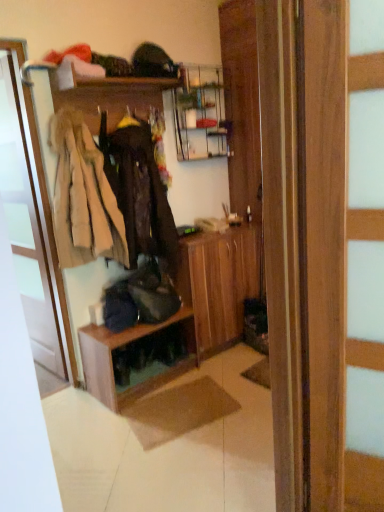
Question: Does dark brown leather jacket at center, the second clothing when ordered from left to right, appear on the left side of beige fur coat at left, the first clothing viewed from the left?

Choices:
 (A) no
 (B) yes

Answer: (A)

Question: Is dark brown leather jacket at center, which ranks as the 1th clothing in right-to-left order, placed right next to beige fur coat at left, the first clothing viewed from the left?

Choices:
 (A) no
 (B) yes

Answer: (A)

Question: Is dark brown leather jacket at center, which ranks as the 1th clothing in right-to-left order, positioned in front of beige fur coat at left, placed as the 2th clothing when sorted from right to left?

Choices:
 (A) no
 (B) yes

Answer: (A)

Question: From the image's perspective, is dark brown leather jacket at center, the second clothing when ordered from left to right, below beige fur coat at left, the first clothing viewed from the left?

Choices:
 (A) no
 (B) yes

Answer: (A)

Question: Does dark brown leather jacket at center, the second clothing when ordered from left to right, have a smaller size compared to beige fur coat at left, placed as the 2th clothing when sorted from right to left?

Choices:
 (A) yes
 (B) no

Answer: (B)

Question: Does dark brown leather jacket at center, which ranks as the 1th clothing in right-to-left order, turn towards beige fur coat at left, the first clothing viewed from the left?

Choices:
 (A) no
 (B) yes

Answer: (A)

Question: Considering the relative positions of wooden coat rack at upper left, the 1th shelf positioned from the top, and white glossy door at left in the image provided, is wooden coat rack at upper left, the 1th shelf positioned from the top, to the left of white glossy door at left from the viewer's perspective?

Choices:
 (A) yes
 (B) no

Answer: (B)

Question: Is wooden coat rack at upper left, acting as the 2th shelf starting from the bottom, not near white glossy door at left?

Choices:
 (A) no
 (B) yes

Answer: (A)

Question: Does wooden coat rack at upper left, acting as the 2th shelf starting from the bottom, appear on the right side of white glossy door at left?

Choices:
 (A) yes
 (B) no

Answer: (A)

Question: Is the position of wooden coat rack at upper left, the 1th shelf positioned from the top, less distant than that of white glossy door at left?

Choices:
 (A) yes
 (B) no

Answer: (B)

Question: Would you say white glossy door at left is part of wooden coat rack at upper left, the 1th shelf positioned from the top,'s contents?

Choices:
 (A) no
 (B) yes

Answer: (A)

Question: Considering the relative sizes of wooden coat rack at upper left, the 1th shelf positioned from the top, and white glossy door at left in the image provided, is wooden coat rack at upper left, the 1th shelf positioned from the top, wider than white glossy door at left?

Choices:
 (A) no
 (B) yes

Answer: (B)

Question: Is dark brown leather jacket at center, the second clothing when ordered from left to right, next to wooden dresser at center and touching it?

Choices:
 (A) yes
 (B) no

Answer: (B)